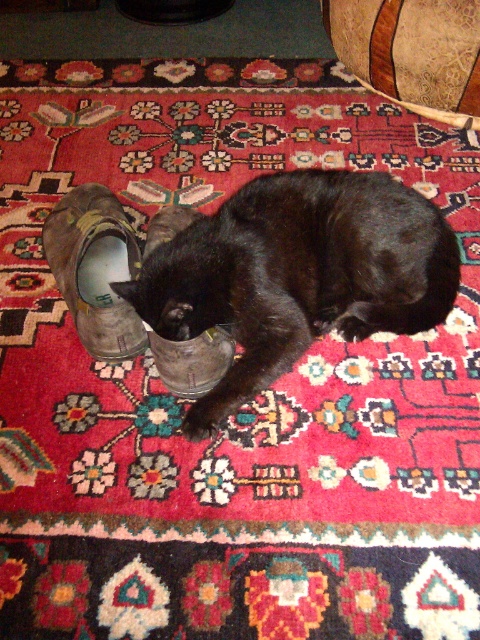
Locate an element on the screen. This screenshot has height=640, width=480. black matte fur cat at center is located at coordinates coord(298,275).

Consider the image. Between black matte fur cat at center and leather/matte shoe at left, which one has less height?

leather/matte shoe at left is shorter.

Between point (359, 284) and point (123, 237), which one is positioned in front?

Point (359, 284) is more forward.

Identify the location of black matte fur cat at center. pos(298,275).